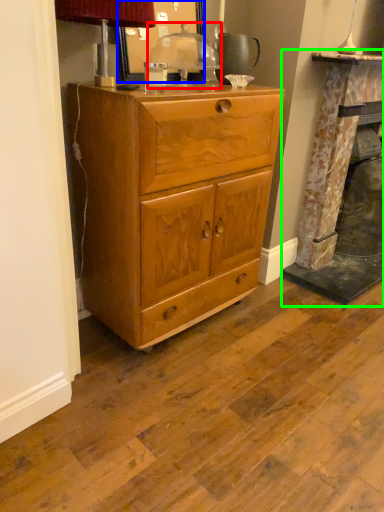
Question: Which is nearer to the table lamp (highlighted by a red box)? mirror (highlighted by a blue box) or fireplace (highlighted by a green box).

Choices:
 (A) mirror
 (B) fireplace

Answer: (A)